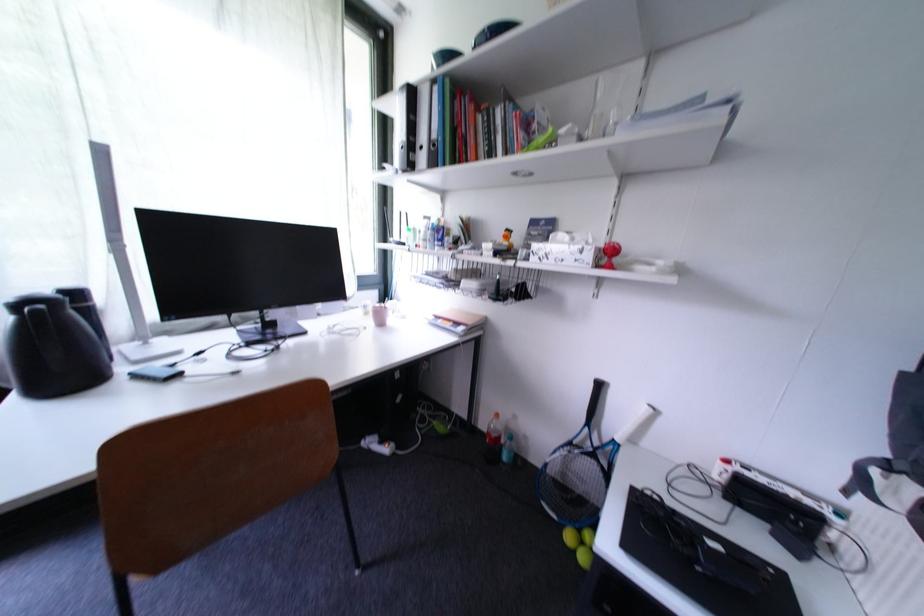
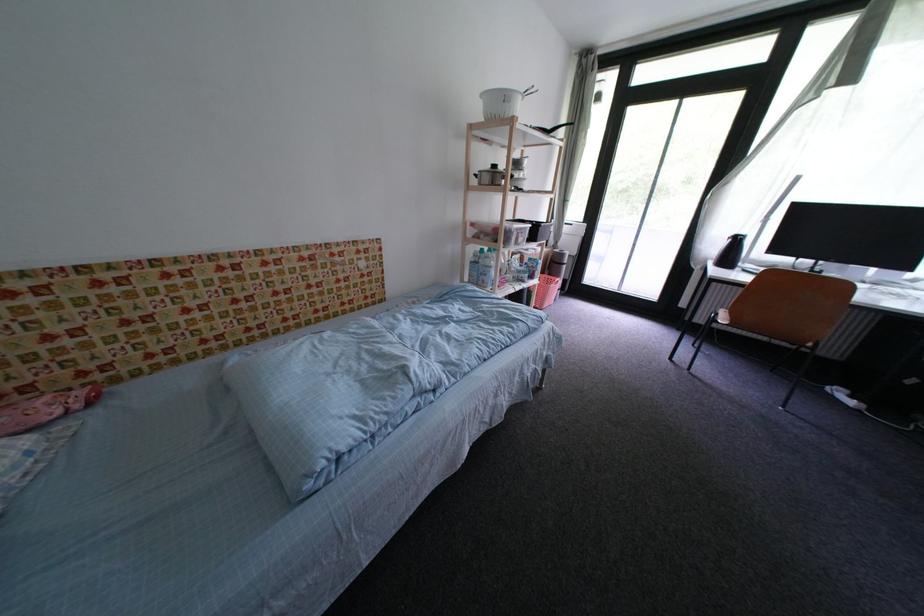
Locate, in the second image, the point that corresponds to [43,313] in the first image.

(747, 241)